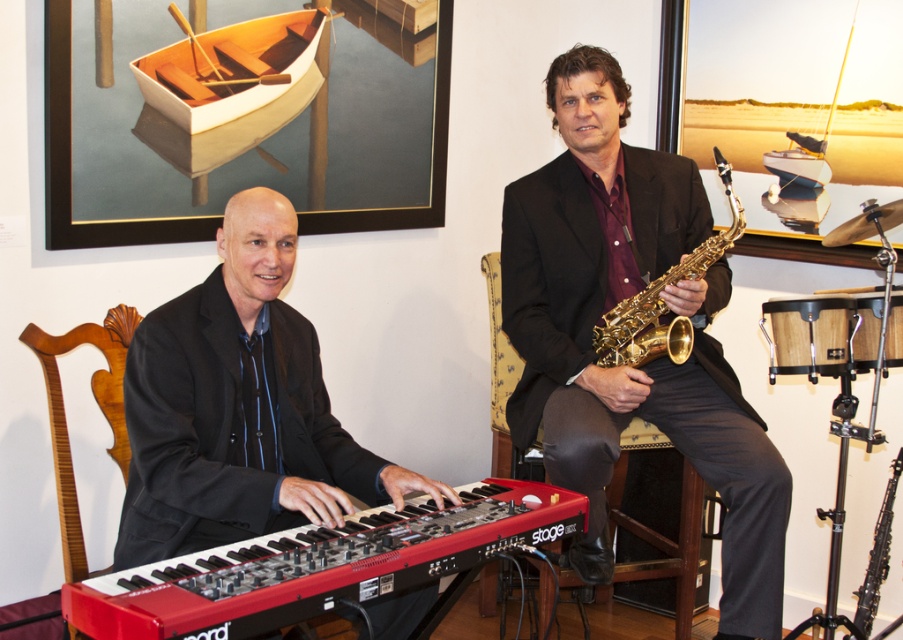
Question: Which object is positioned closest to the shiny gold saxophone at center?

Choices:
 (A) black matte keyboard at left
 (B) black glossy oboe at right
 (C) wooden boat at upper left

Answer: (B)

Question: From the image, what is the correct spatial relationship of black matte keyboard at left in relation to red matte keyboard at center?

Choices:
 (A) below
 (B) above

Answer: (B)

Question: Which of these objects is positioned closest to the yellow fabric chair at center?

Choices:
 (A) black matte keyboard at left
 (B) gold shiny saxophone at right
 (C) black glossy oboe at right
 (D) wooden boat at upper left

Answer: (B)

Question: Which of the following is the closest to the observer?

Choices:
 (A) tap(822, 157)
 (B) tap(143, 80)
 (C) tap(338, 544)

Answer: (C)

Question: Can you confirm if wooden boat at upper left is thinner than yellow fabric chair at center?

Choices:
 (A) no
 (B) yes

Answer: (B)

Question: Can you confirm if black matte keyboard at left is thinner than white wooden boat at upper right?

Choices:
 (A) yes
 (B) no

Answer: (B)